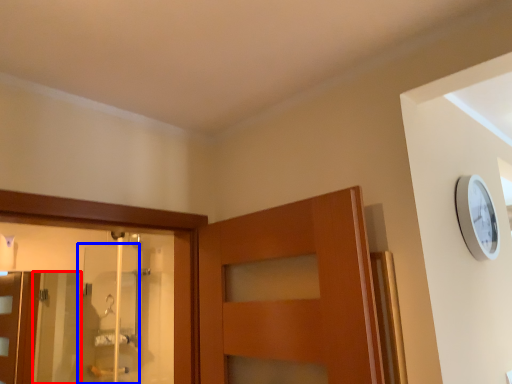
Question: Which point is further to the camera, screen door (highlighted by a red box) or screen door (highlighted by a blue box)?

Choices:
 (A) screen door
 (B) screen door

Answer: (A)